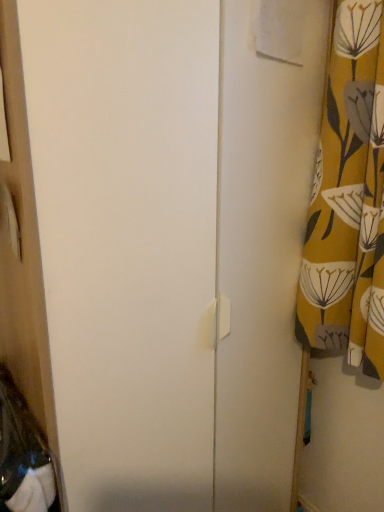
Question: Based on their sizes in the image, would you say white matte screen door at center is bigger or smaller than yellow floral fabric at right?

Choices:
 (A) small
 (B) big

Answer: (B)

Question: Is white matte screen door at center in front of or behind yellow floral fabric at right in the image?

Choices:
 (A) behind
 (B) front

Answer: (B)

Question: Is white matte screen door at center inside or outside of yellow floral fabric at right?

Choices:
 (A) inside
 (B) outside

Answer: (B)

Question: Considering the positions of yellow floral fabric at right and white matte screen door at center in the image, is yellow floral fabric at right taller or shorter than white matte screen door at center?

Choices:
 (A) tall
 (B) short

Answer: (B)

Question: Would you say yellow floral fabric at right is to the left or to the right of white matte screen door at center in the picture?

Choices:
 (A) right
 (B) left

Answer: (A)

Question: Does point (332, 133) appear closer or farther from the camera than point (84, 494)?

Choices:
 (A) closer
 (B) farther

Answer: (B)

Question: From the image's perspective, is yellow floral fabric at right located above or below white matte screen door at center?

Choices:
 (A) above
 (B) below

Answer: (A)